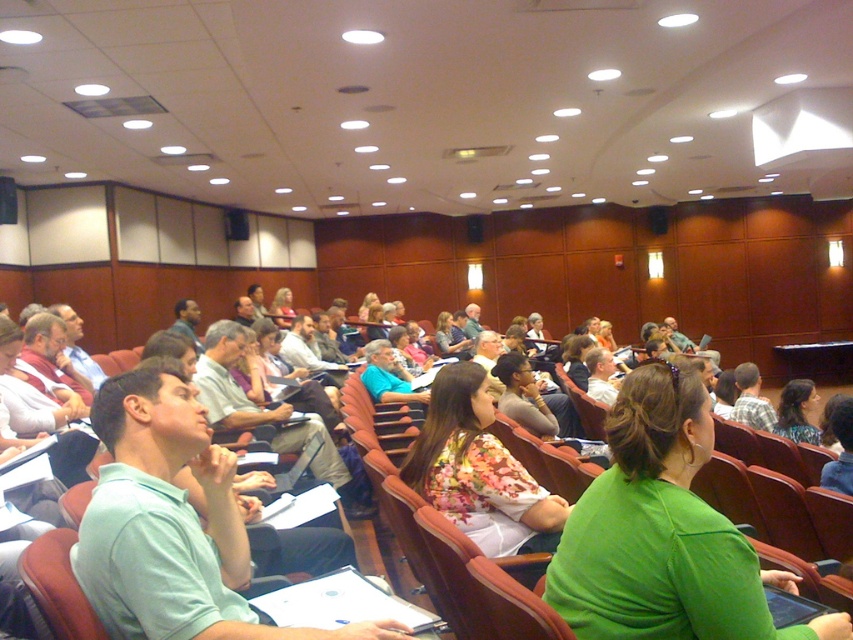
Question: Which of the following is the farthest from the observer?

Choices:
 (A) (788, 420)
 (B) (437, 420)

Answer: (A)

Question: Does floral print blouse at center appear on the left side of floral fabric dress at center?

Choices:
 (A) yes
 (B) no

Answer: (A)

Question: Which of the following is the closest to the observer?

Choices:
 (A) floral fabric dress at center
 (B) floral print blouse at center

Answer: (B)

Question: Is floral print blouse at center to the left of floral fabric dress at center from the viewer's perspective?

Choices:
 (A) no
 (B) yes

Answer: (B)

Question: Can you confirm if floral print blouse at center is bigger than floral fabric dress at center?

Choices:
 (A) yes
 (B) no

Answer: (A)